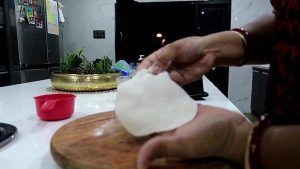
Locate an element on the screen. This screenshot has height=169, width=300. doorway into next room is located at coordinates (175, 19).